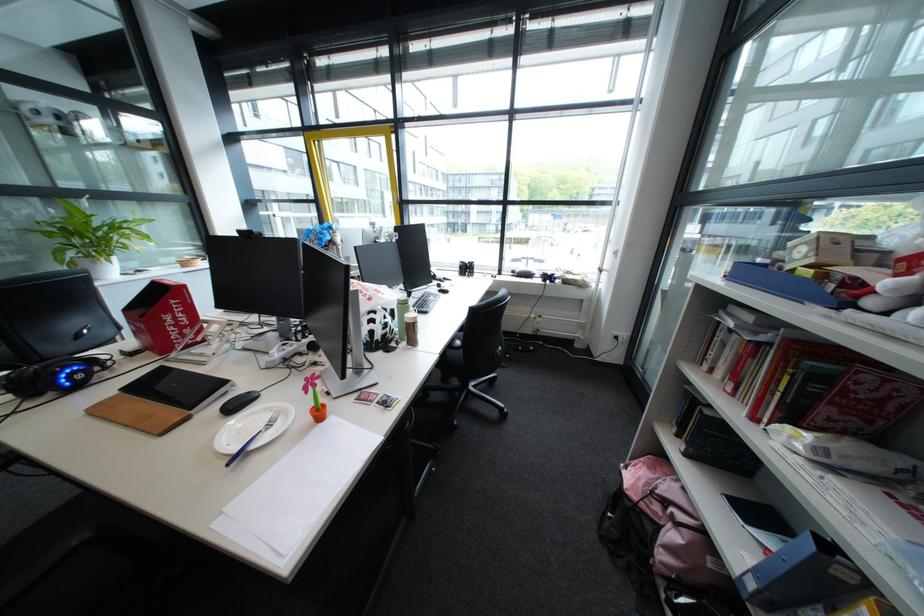
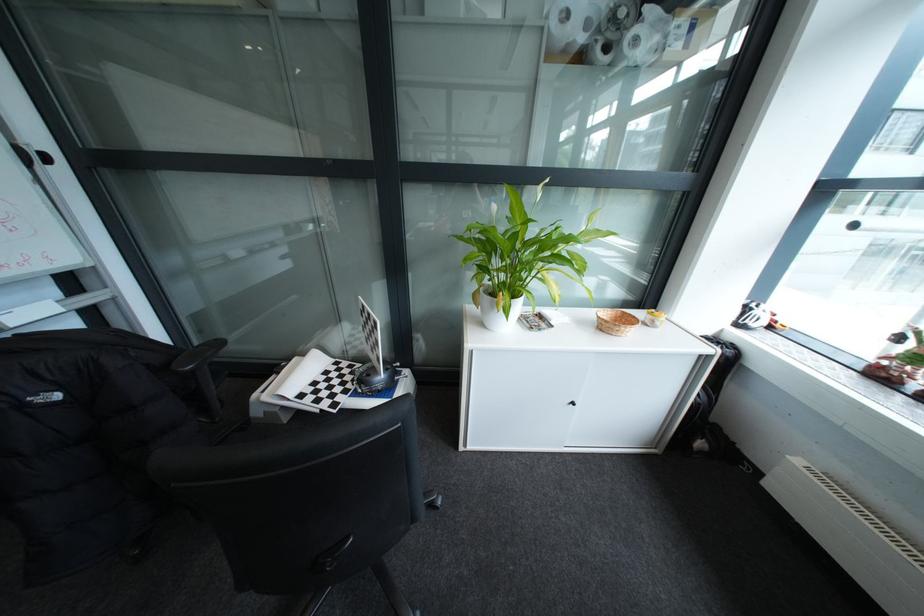
Find the pixel in the second image that matches [119,254] in the first image.

(521, 299)